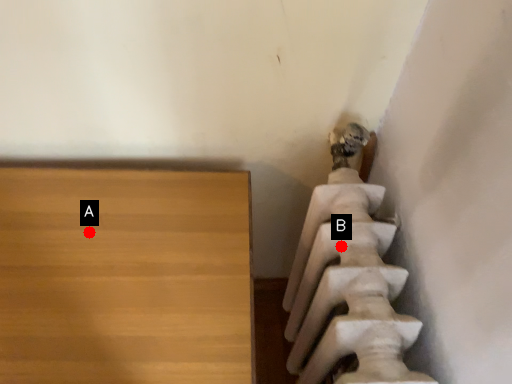
Question: Two points are circled on the image, labeled by A and B beside each circle. Which of the following is the farthest from the observer?

Choices:
 (A) A is further
 (B) B is further

Answer: (A)